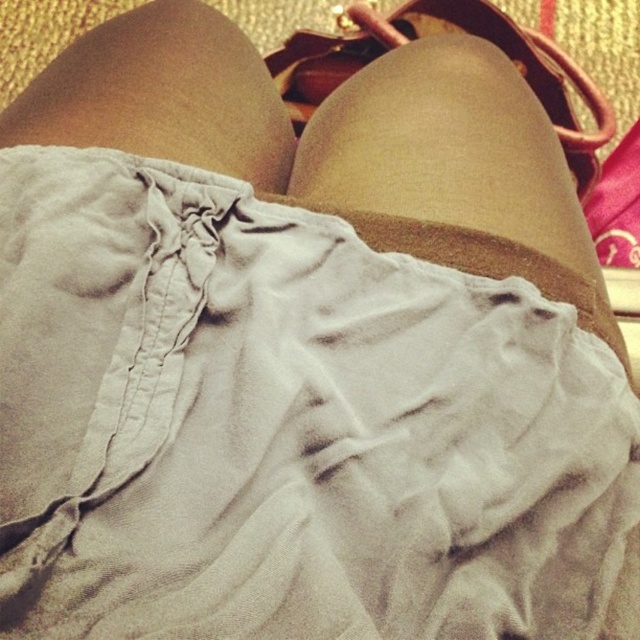
Is point (173, 125) positioned behind point (284, 49)?

No, it is not.

Which is behind, point (234, 93) or point (401, 35)?

The point (401, 35) is behind.

This screenshot has width=640, height=640. In order to click on matte beige shorts at center in this screenshot , I will do `click(163, 96)`.